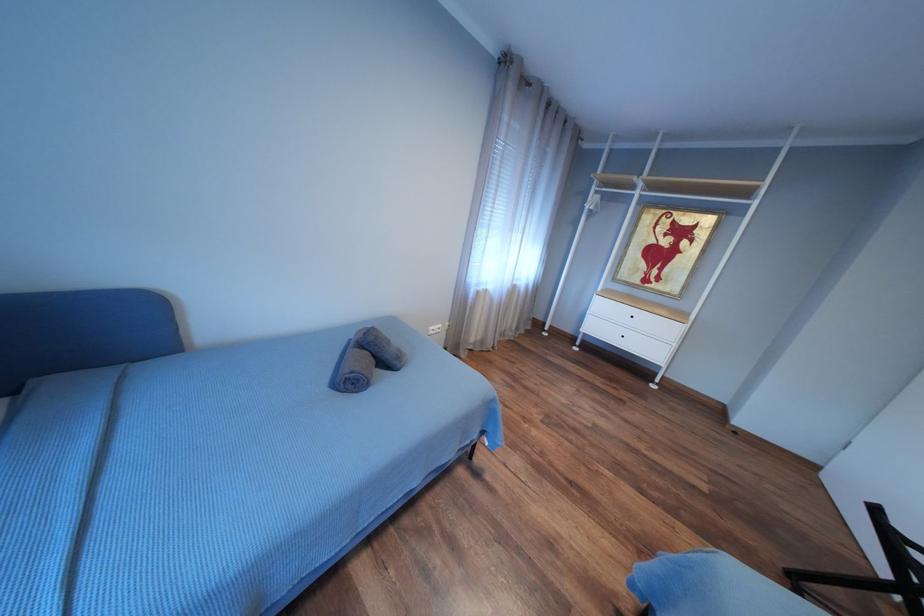
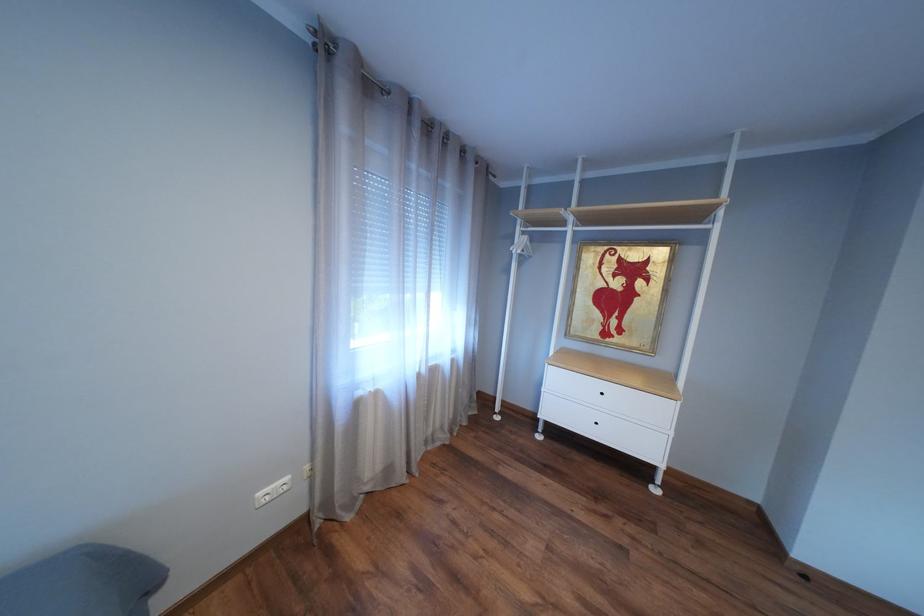
The images are taken continuously from a first-person perspective. In which direction are you moving?

The cameraman walked toward right, forward.